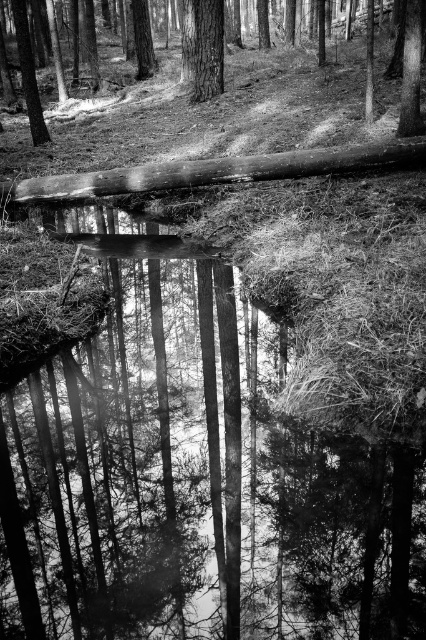
Is the position of smooth bark tree at upper center less distant than that of smooth bark tree at center?

Yes.

Looking at this image, who is higher up, smooth bark tree at upper center or smooth bark tree at center?

smooth bark tree at upper center is higher up.

This screenshot has width=426, height=640. Identify the location of smooth bark tree at upper center. (233, 108).

Is smooth bark tree at center thinner than smooth bark tree at upper left?

Yes, smooth bark tree at center is thinner than smooth bark tree at upper left.

Is smooth bark tree at center closer to camera compared to smooth bark tree at upper left?

No.

The height and width of the screenshot is (640, 426). I want to click on smooth bark tree at center, so click(x=203, y=48).

Where is `smooth bark tree at center`? smooth bark tree at center is located at coordinates (203, 48).

Does smooth wooden log at center appear over smooth bark tree at center?

No, smooth wooden log at center is not above smooth bark tree at center.

Is point (103, 188) positioned after point (207, 36)?

No, it is in front of (207, 36).

Is point (132, 180) more distant than point (195, 12)?

No, (132, 180) is in front of (195, 12).

This screenshot has width=426, height=640. Identify the location of smooth wooden log at center. (213, 172).